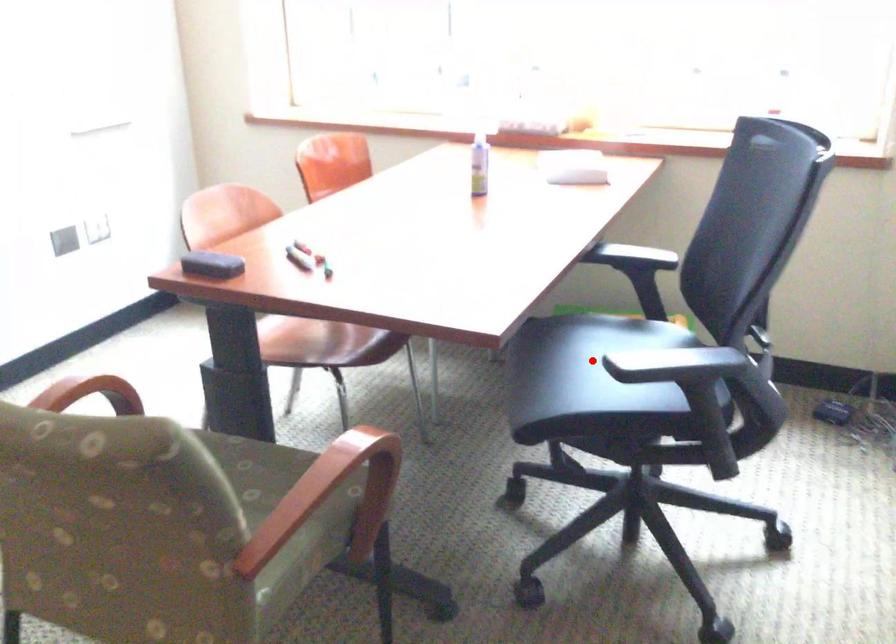
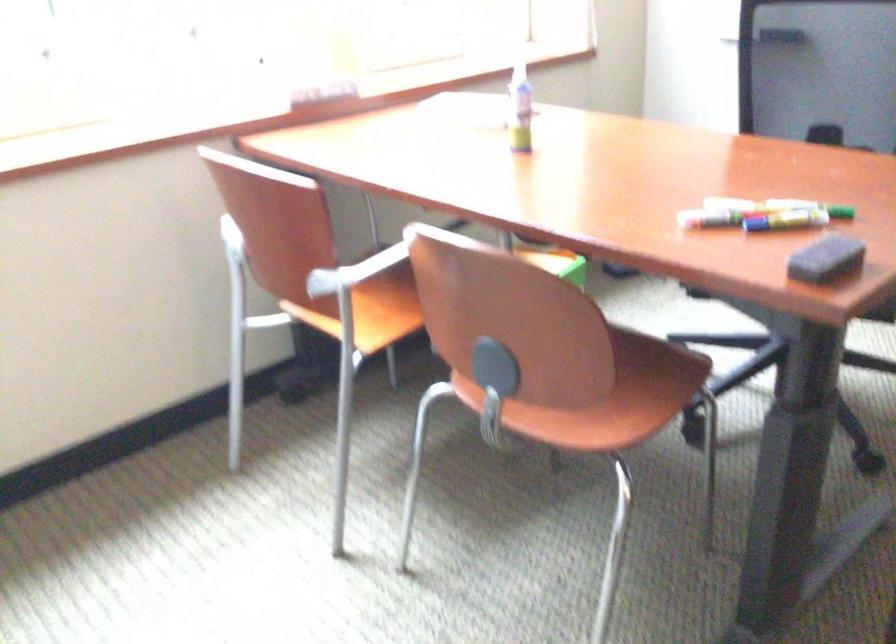
Question: I am providing you with two images of the same scene from different viewpoints. A red point is marked on the first image. Is the red point's position out of view in image 2?

Choices:
 (A) Yes
 (B) No

Answer: (A)